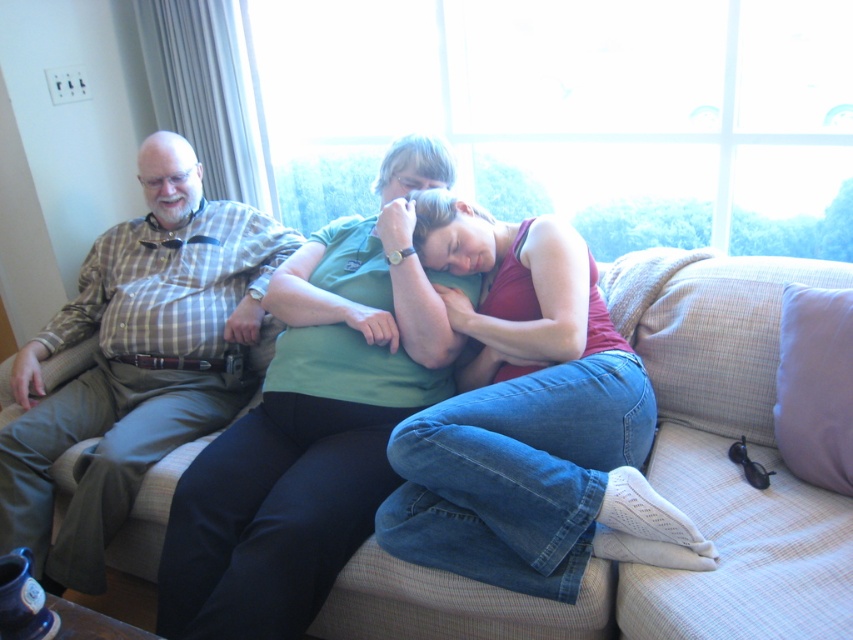
Question: Is transparent glass window at upper center below matte green tank top at center?

Choices:
 (A) no
 (B) yes

Answer: (A)

Question: Is transparent glass window at upper center thinner than matte green tank top at center?

Choices:
 (A) yes
 (B) no

Answer: (B)

Question: Which object is closer to the camera taking this photo?

Choices:
 (A) purple fabric pillow at right
 (B) matte green shirt at center

Answer: (B)

Question: Which object is closer to the camera taking this photo?

Choices:
 (A) matte green tank top at center
 (B) plaid shirt at left

Answer: (A)

Question: Which of these objects is positioned closest to the transparent glass window at upper center?

Choices:
 (A) plaid shirt at left
 (B) beige fabric couch at center
 (C) matte green shirt at center

Answer: (B)

Question: Is plaid shirt at left to the right of purple fabric pillow at right from the viewer's perspective?

Choices:
 (A) no
 (B) yes

Answer: (A)